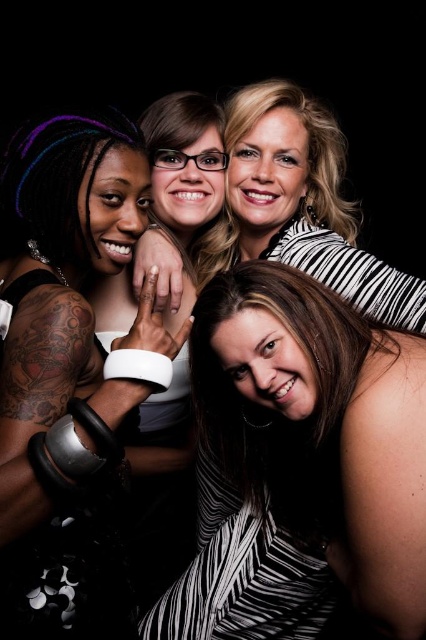
You are standing in front of the image and notice the striped fabric dress at lower right. Based on its position, can you determine if it is closer to the bottom edge or the right edge of the image?

The striped fabric dress at lower right is located at point 0.727 on the x and 0.704 on the y. Since both coordinates are above 0.5, it is closer to the bottom edge than the right edge.

You are standing in front of the image and want to touch the two points mentioned. Which point, point (285, 340) or point (131, 403), is closer to you?

Point (285, 340) is closer to you because it is further to the viewer than point (131, 403).